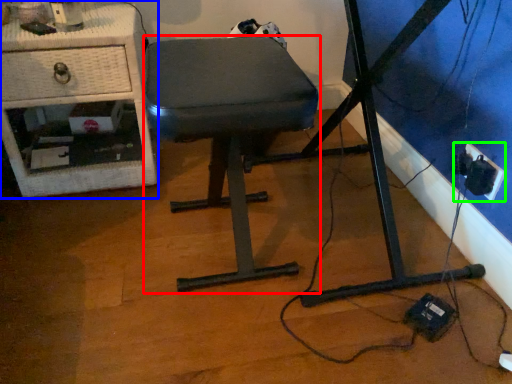
Question: Based on their relative distances, which object is farther from stool (highlighted by a red box)? Choose from furniture (highlighted by a blue box) and electric outlet (highlighted by a green box).

Choices:
 (A) furniture
 (B) electric outlet

Answer: (B)